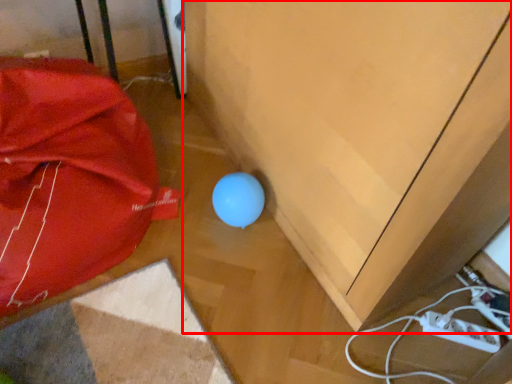
Question: Considering the relative positions of furniture (annotated by the red box) and umbrella in the image provided, where is furniture (annotated by the red box) located with respect to the staircase?

Choices:
 (A) right
 (B) left

Answer: (A)